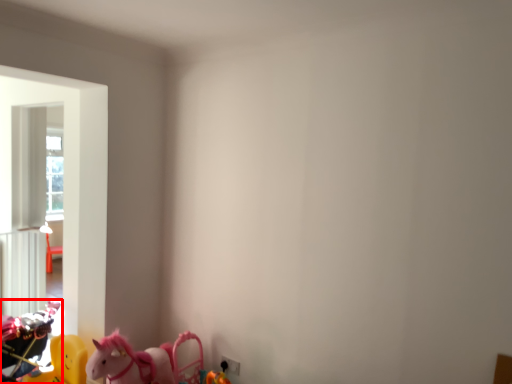
Question: From the image, what is the correct spatial relationship of toy (annotated by the red box) in relation to toy?

Choices:
 (A) right
 (B) left

Answer: (B)